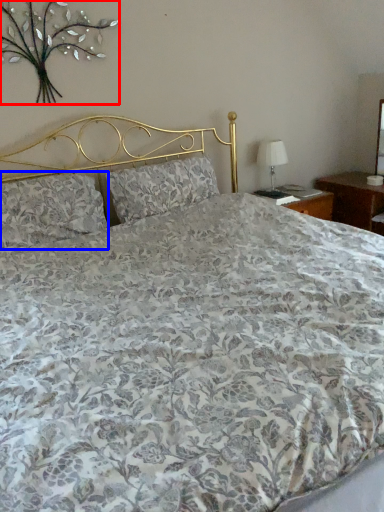
Question: Which object appears farthest to the camera in this image, floral arrangement (highlighted by a red box) or pillow (highlighted by a blue box)?

Choices:
 (A) floral arrangement
 (B) pillow

Answer: (B)